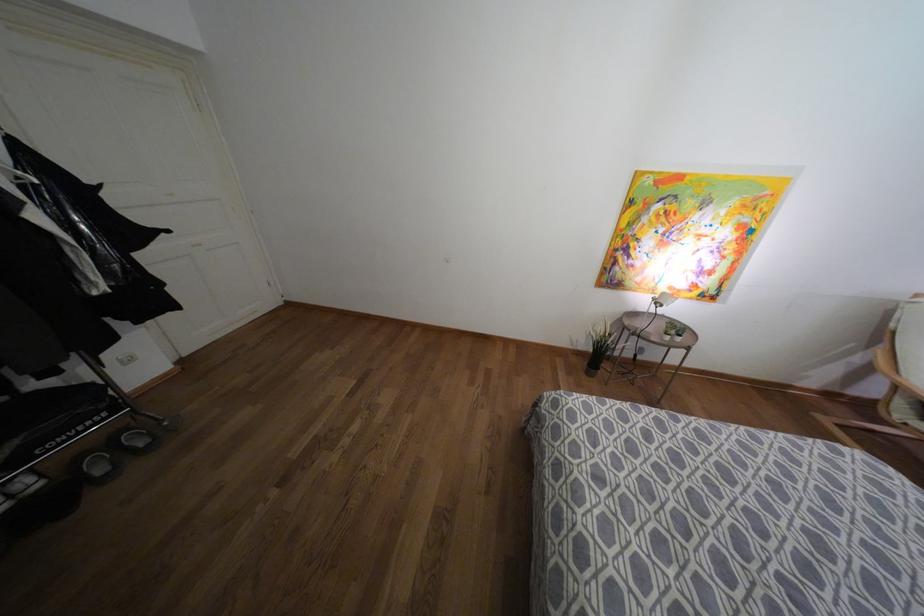
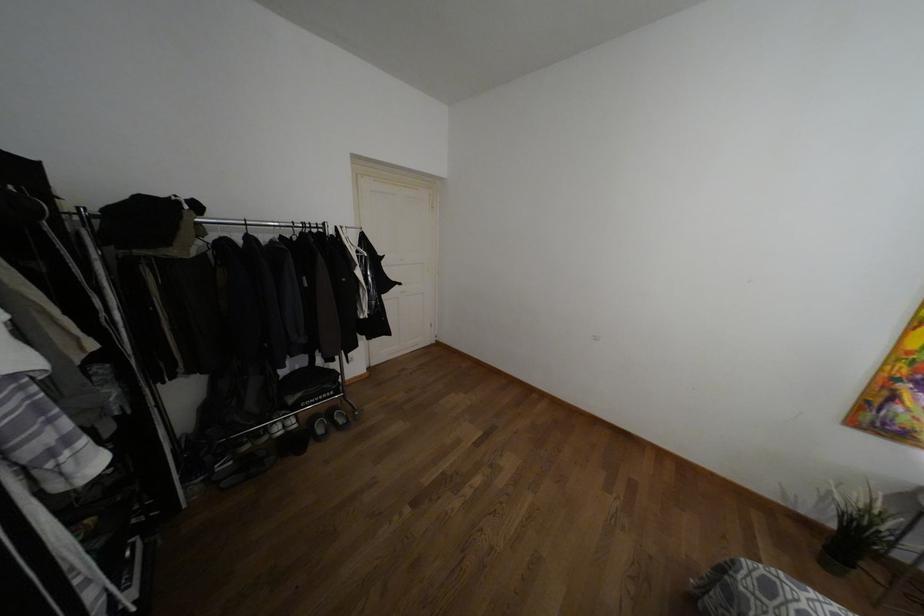
The point at (600, 329) is marked in the first image. Where is the corresponding point in the second image?

(855, 496)